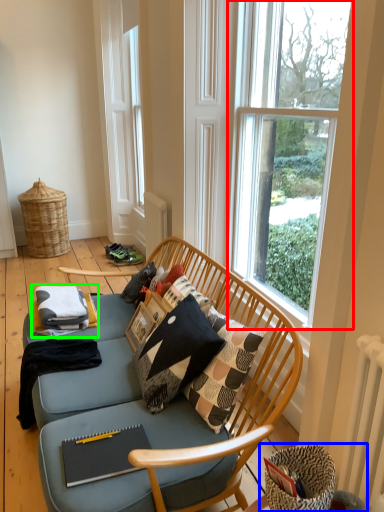
Question: Which object is positioned farthest from window (highlighted by a red box)? Select from swivel chair (highlighted by a blue box) and material (highlighted by a green box).

Choices:
 (A) swivel chair
 (B) material

Answer: (B)